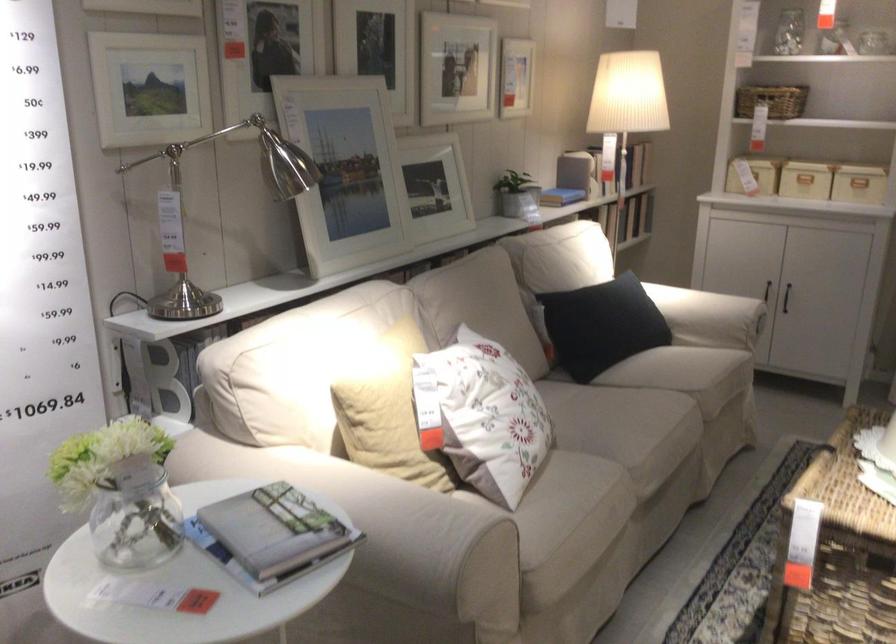
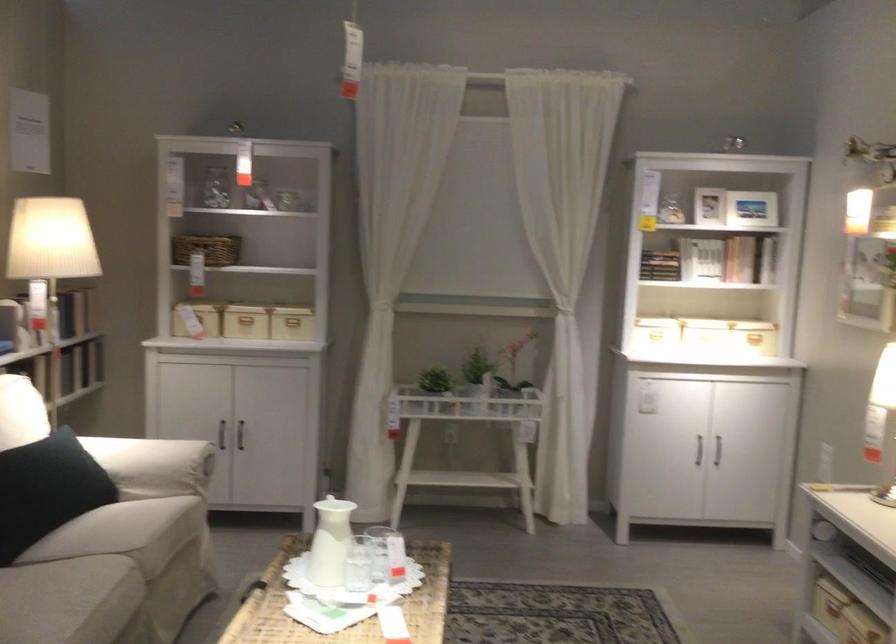
In the second image, find the point that corresponds to [767,82] in the first image.

(207, 249)